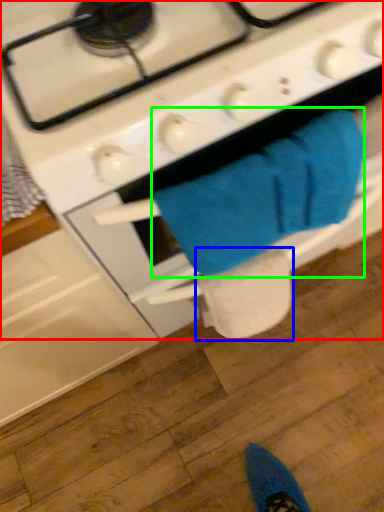
Question: Which object is the farthest from gas stove (highlighted by a red box)? Choose among these: toilet paper (highlighted by a blue box) or bath towel (highlighted by a green box).

Choices:
 (A) toilet paper
 (B) bath towel

Answer: (A)